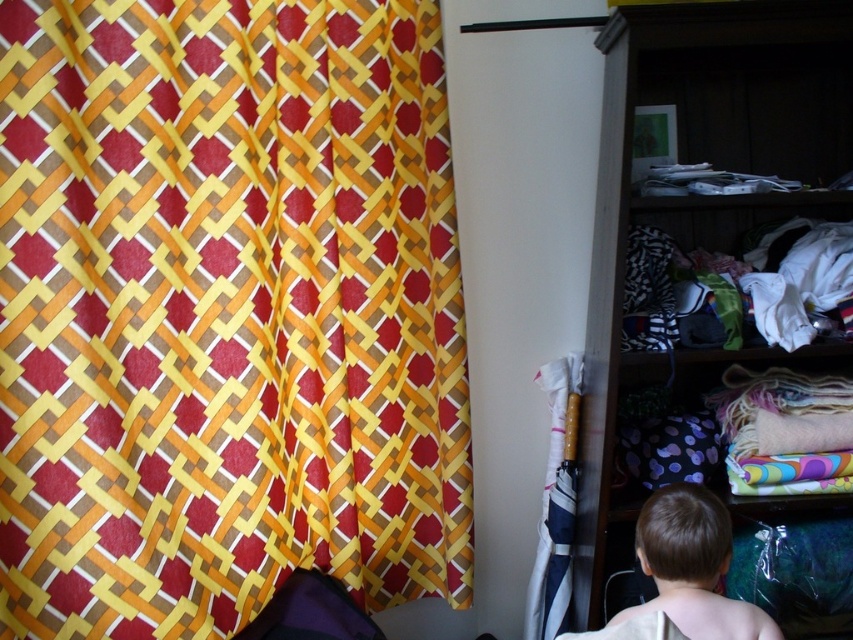
From the picture: Which of these two, light brown hair at lower right or white fabric umbrella at center, stands shorter?

Standing shorter between the two is light brown hair at lower right.

Does light brown hair at lower right come in front of white fabric umbrella at center?

That is True.

Who is more forward, [653,529] or [567,573]?

Point [653,529] is more forward.

Find the location of a particular element. The height and width of the screenshot is (640, 853). light brown hair at lower right is located at coordinates (692, 566).

Measure the distance from red-yellow woven fabric at left to white fabric umbrella at center.

They are 23.70 inches apart.

Describe the element at coordinates (225, 312) in the screenshot. The image size is (853, 640). I see `red-yellow woven fabric at left` at that location.

This screenshot has width=853, height=640. I want to click on red-yellow woven fabric at left, so click(x=225, y=312).

Can you confirm if red-yellow woven fabric at left is positioned to the left of wooden shelves at right?

Yes, red-yellow woven fabric at left is to the left of wooden shelves at right.

Is red-yellow woven fabric at left above wooden shelves at right?

No.

Is point (97, 570) in front of point (592, 273)?

Yes, it is in front of point (592, 273).

Find the location of a particular element. Image resolution: width=853 pixels, height=640 pixels. red-yellow woven fabric at left is located at coordinates (225, 312).